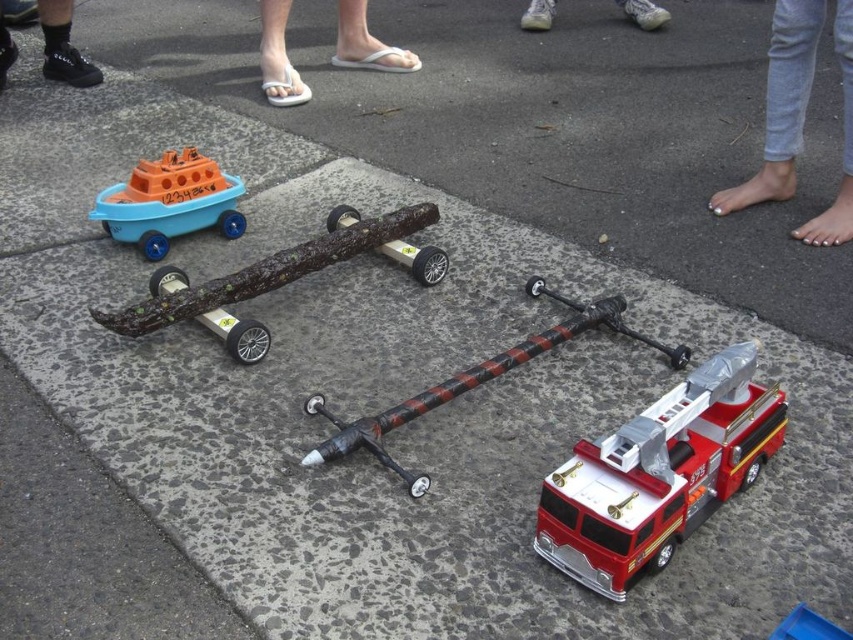
You are standing at the origin point of the coordinate system in this scene. The red toy fire truck on the right and the white rubber flip flops at center are both visible. Which object is closer to you based on their coordinates?

The white rubber flip flops at center is located at point (366, 44), while the red toy fire truck on the right is positioned further away. Since the flip flops have a smaller first coordinate value, they are closer to the observer at the origin.

You are a delivery robot that needs to pass between the gray denim jeans at upper right and the black leather shoe at upper left. Your robot is 0.5 meters wide. Can you fit through the space between them?

The gray denim jeans at upper right might be wider than the black leather shoe at upper left, so the space between them may not be wide enough for the robot to pass through safely. It is recommended to choose a different path.